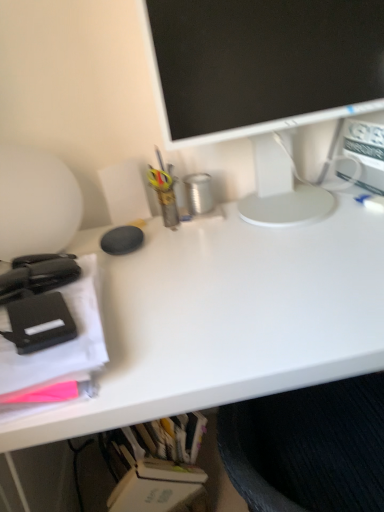
You are a GUI agent. You are given a task and a screenshot of the screen. Output one action in this format:
    pyautogui.click(x=<x>, y=<y>)
    Task: Click on the free area in between white glossy monitor at upper center and black matte stapler at left, which appears as the second office supplies when viewed from the front
    The height and width of the screenshot is (512, 384).
    Given the screenshot: What is the action you would take?
    pyautogui.click(x=200, y=246)